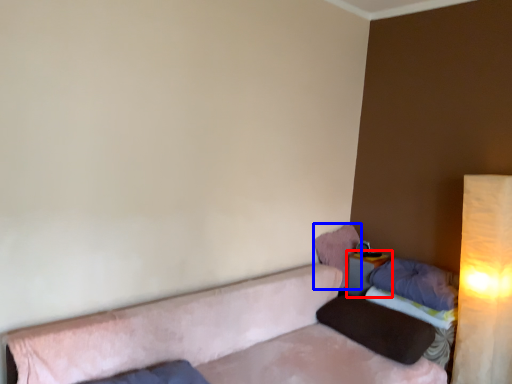
Question: Which object is closer to the camera taking this photo, table (highlighted by a red box) or pillow (highlighted by a blue box)?

Choices:
 (A) table
 (B) pillow

Answer: (A)